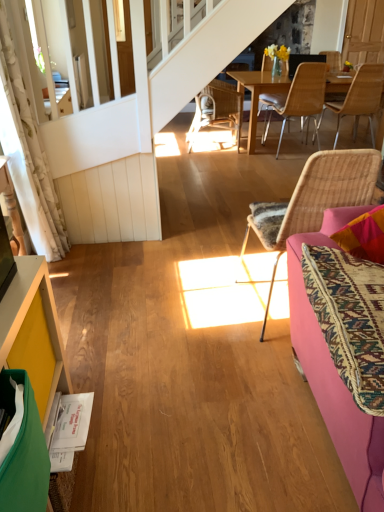
Where is `vacant space that is in between white floral fabric curtain at left and woven rattan chair at center, arranged as the 4th chair when viewed from the back`? Image resolution: width=384 pixels, height=512 pixels. vacant space that is in between white floral fabric curtain at left and woven rattan chair at center, arranged as the 4th chair when viewed from the back is located at coordinates (159, 280).